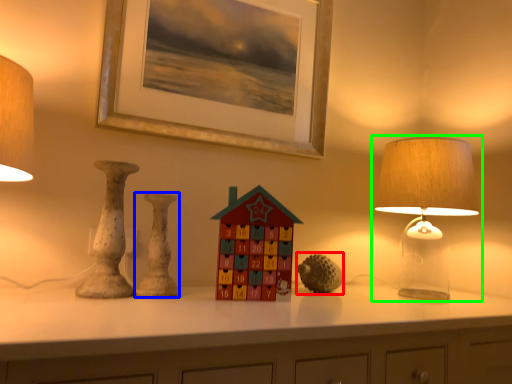
Question: Considering the real-world distances, which object is farthest from toy (highlighted by a red box)? vase (highlighted by a blue box) or lamp (highlighted by a green box)?

Choices:
 (A) vase
 (B) lamp

Answer: (A)